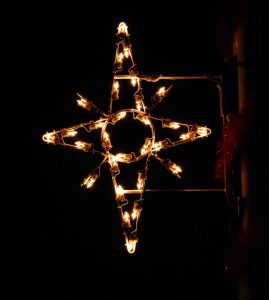
The width and height of the screenshot is (269, 300). Identify the location of bracket. (195, 76).